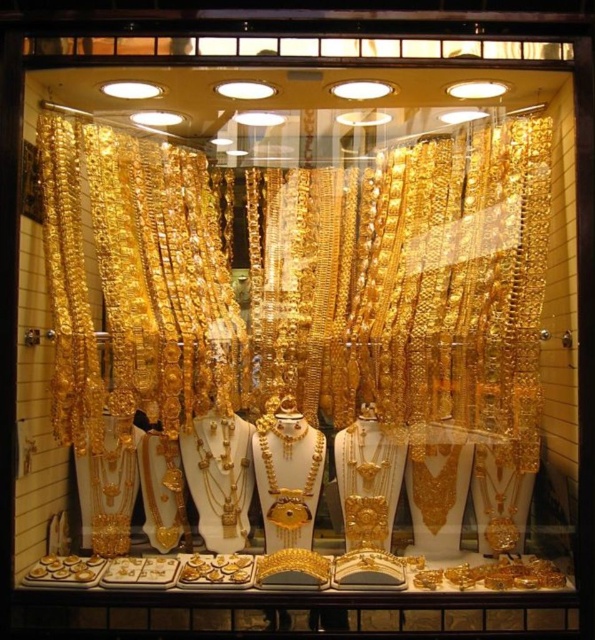
You are a customer in the jewelry store looking at the shiny gold jewelry at center and the gold shiny necklace at center. Which object is taller?

The shiny gold jewelry at center is taller than the gold shiny necklace at center.

You are a customer standing in front of the shop window. You notice the shiny gold jewelry at center. Can you determine its exact position using the coordinate system provided?

The shiny gold jewelry at center is located at point coordinates (305, 330).

You are a customer standing in front of the shop window. You see the shiny gold jewelry at center and the gold shiny necklace at center. Which one appears closer to you?

The shiny gold jewelry at center appears closer to you because it is positioned nearer than the gold shiny necklace at center.